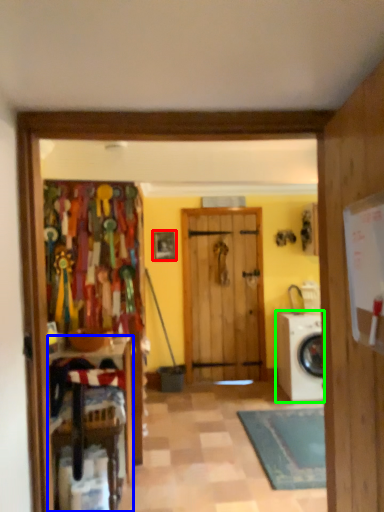
Question: Which is farther away from picture frame (highlighted by a red box)? furniture (highlighted by a blue box) or washing machine (highlighted by a green box)?

Choices:
 (A) furniture
 (B) washing machine

Answer: (A)